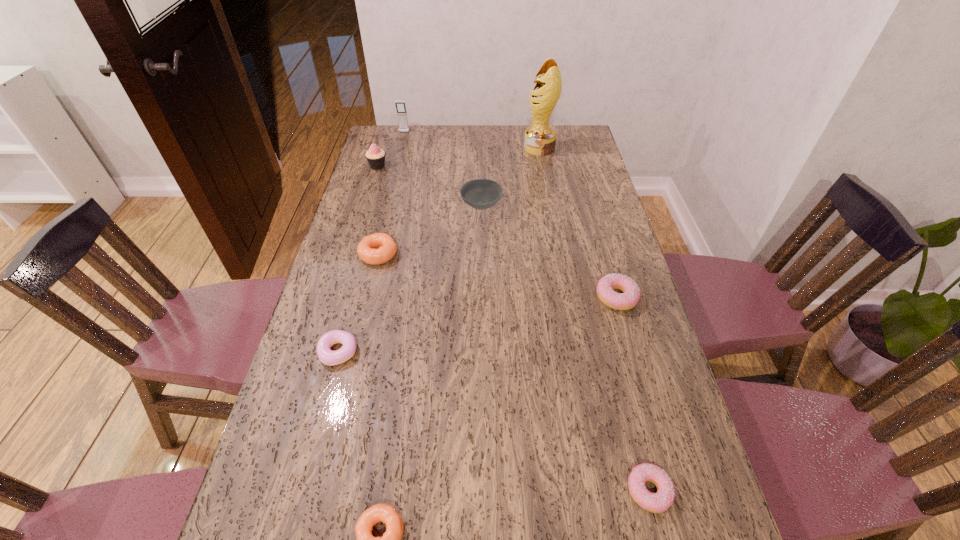
Locate an element on the screen. The image size is (960, 540). empty space that is in between the fifth nearest object and the eighth shortest object is located at coordinates (392, 193).

At what (x,y) coordinates should I click in order to perform the action: click on vacant space that's between the fourth tallest object and the sixth farthest object. Please return your answer as a coordinate pair (x, y). Looking at the image, I should click on (549, 252).

Where is `free space between the gold award and the nearer pink doughnut`? The image size is (960, 540). free space between the gold award and the nearer pink doughnut is located at coordinates coord(594,319).

In order to click on free space between the purple doughnut and the fifth farthest object in this screenshot , I will do `click(359, 303)`.

What are the coordinates of `free area in between the bowl and the nearer pink doughnut` in the screenshot? It's located at coord(565,348).

I want to click on vacant point located between the farthest doughnut and the fourth nearest object, so click(x=497, y=276).

Find the location of a particular element. The width and height of the screenshot is (960, 540). vacant space in between the fourth tallest object and the seventh shortest object is located at coordinates (429, 186).

Locate an element on the screen. The height and width of the screenshot is (540, 960). object that can be found as the seventh closest to the farthest doughnut is located at coordinates (400, 105).

Choose which object is the sixth nearest neighbor to the fifth nearest object. Please provide its 2D coordinates. Your answer should be formatted as a tuple, i.e. [(x, y)], where the tuple contains the x and y coordinates of a point satisfying the conditions above.

[(540, 138)]

At what (x,y) coordinates should I click in order to perform the action: click on the fifth closest doughnut to the pink cupcake. Please return your answer as a coordinate pair (x, y). This screenshot has height=540, width=960. Looking at the image, I should click on (658, 502).